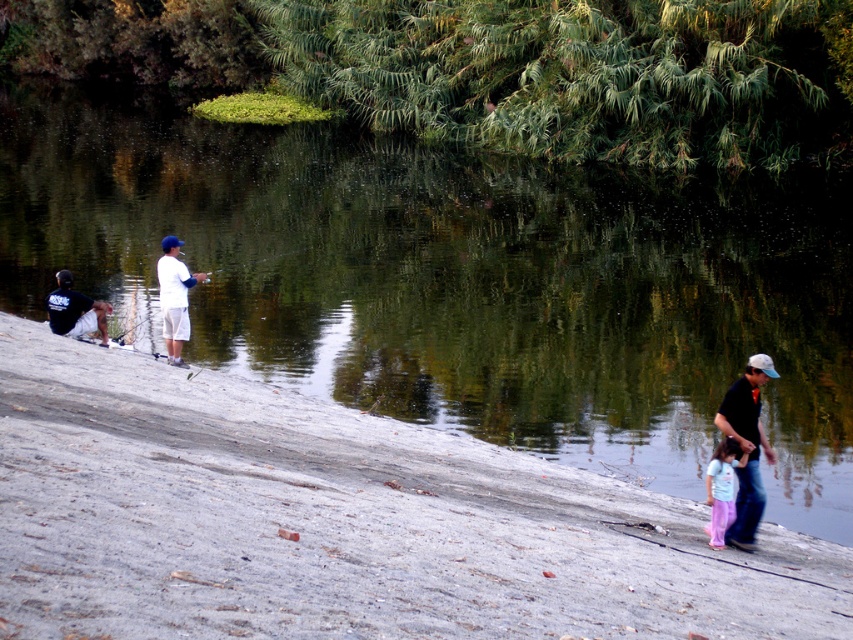
Question: Which of the following is the closest to the observer?

Choices:
 (A) (73, 305)
 (B) (735, 424)
 (C) (722, 444)

Answer: (C)

Question: Based on their relative distances, which object is nearer to the sandy shore at lower left?

Choices:
 (A) white matte baseball cap at upper center
 (B) matte black shirt at lower right
 (C) dark blue t-shirt at left

Answer: (B)

Question: Can you confirm if dark blue t-shirt at left is positioned above light blue cotton shirt at lower right?

Choices:
 (A) no
 (B) yes

Answer: (B)

Question: Can you confirm if green reflective water at center is wider than white matte baseball cap at upper center?

Choices:
 (A) no
 (B) yes

Answer: (B)

Question: Observing the image, what is the correct spatial positioning of matte black shirt at lower right in reference to dark blue t-shirt at left?

Choices:
 (A) below
 (B) above

Answer: (A)

Question: Among these points, which one is farthest from the camera?

Choices:
 (A) (718, 547)
 (B) (427, 458)
 (C) (180, 358)
 (D) (753, 374)

Answer: (C)